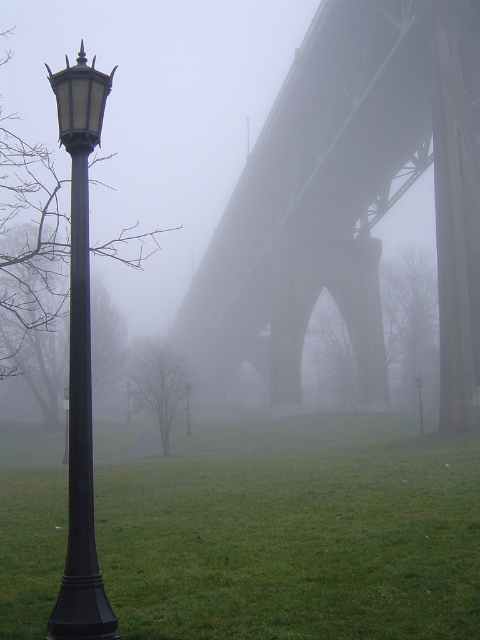
Question: Which of the following is the closest to the observer?

Choices:
 (A) dark gray concrete suspension bridge at center
 (B) matte black lamp post at center

Answer: (A)

Question: Can you confirm if black matte pole at left is positioned below matte black lamp post at left?

Choices:
 (A) no
 (B) yes

Answer: (B)

Question: Among these objects, which one is nearest to the camera?

Choices:
 (A) matte black lamp post at center
 (B) dark gray concrete suspension bridge at center
 (C) green grass at left
 (D) matte black lamp post at left

Answer: (C)

Question: Which object is the closest to the matte black lamp post at center?

Choices:
 (A) dark gray concrete suspension bridge at center
 (B) green grass at left
 (C) matte black lamp post at left

Answer: (B)

Question: Is green grass at left further to the viewer compared to black matte pole at left?

Choices:
 (A) no
 (B) yes

Answer: (B)

Question: Does green grass at left appear over matte black lamp post at left?

Choices:
 (A) yes
 (B) no

Answer: (B)